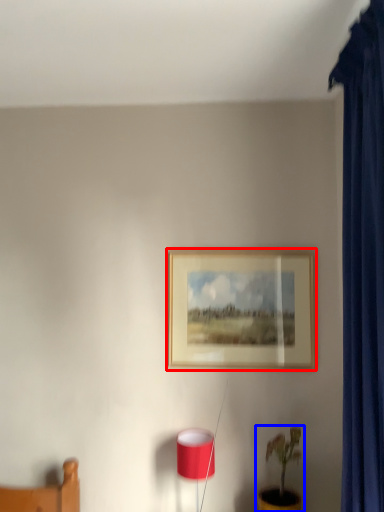
Question: Among these objects, which one is farthest to the camera, picture frame (highlighted by a red box) or houseplant (highlighted by a blue box)?

Choices:
 (A) picture frame
 (B) houseplant

Answer: (A)